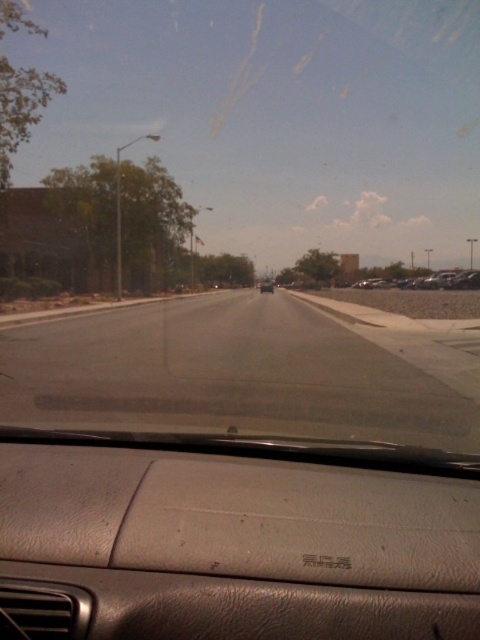
You are driving a car and want to check the distance between the transparent glass windshield at center and the metallic silver car at right. Which object would appear closer to you from your current position?

The transparent glass windshield at center appears closer because it is larger in size compared to the metallic silver car at right, indicating it is nearer to the driver.